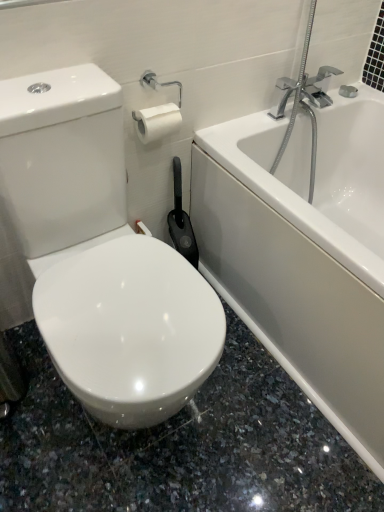
Question: Considering the relative sizes of white glossy toilet at center and white glossy bathtub at upper right in the image provided, is white glossy toilet at center wider than white glossy bathtub at upper right?

Choices:
 (A) yes
 (B) no

Answer: (B)

Question: Is white glossy toilet at center completely or partially outside of white glossy bathtub at upper right?

Choices:
 (A) no
 (B) yes

Answer: (B)

Question: From the image's perspective, does white glossy toilet at center appear lower than white glossy bathtub at upper right?

Choices:
 (A) yes
 (B) no

Answer: (A)

Question: From the image's perspective, would you say white glossy toilet at center is positioned over white glossy bathtub at upper right?

Choices:
 (A) yes
 (B) no

Answer: (B)

Question: Is white glossy toilet at center to the left of white glossy bathtub at upper right from the viewer's perspective?

Choices:
 (A) yes
 (B) no

Answer: (A)

Question: Can you confirm if white glossy toilet at center is smaller than white glossy bathtub at upper right?

Choices:
 (A) no
 (B) yes

Answer: (B)

Question: Is white glossy bathtub at upper right far from white glossy toilet at center?

Choices:
 (A) yes
 (B) no

Answer: (B)

Question: Considering the relative sizes of white glossy bathtub at upper right and white glossy toilet at center in the image provided, is white glossy bathtub at upper right smaller than white glossy toilet at center?

Choices:
 (A) yes
 (B) no

Answer: (B)

Question: From the image's perspective, would you say white glossy bathtub at upper right is shown under white glossy toilet at center?

Choices:
 (A) yes
 (B) no

Answer: (B)

Question: Is the position of white glossy bathtub at upper right less distant than that of white glossy toilet at center?

Choices:
 (A) yes
 (B) no

Answer: (B)

Question: Considering the relative positions of white glossy bathtub at upper right and white glossy toilet at center in the image provided, is white glossy bathtub at upper right to the left of white glossy toilet at center from the viewer's perspective?

Choices:
 (A) no
 (B) yes

Answer: (A)

Question: Would you say white glossy toilet at center is part of white glossy bathtub at upper right's contents?

Choices:
 (A) yes
 (B) no

Answer: (B)

Question: Looking at the image, does white glossy bathtub at upper right seem bigger or smaller compared to white glossy toilet at center?

Choices:
 (A) big
 (B) small

Answer: (A)